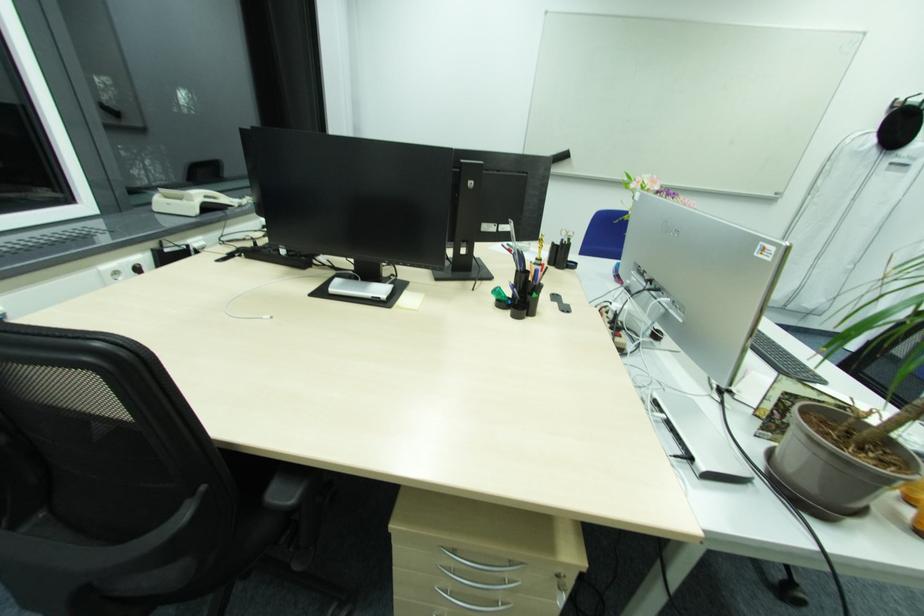
At what (x,y) coordinates should I click in order to perform the action: click on cabinet lock. Please return your answer as a coordinate pair (x, y). The height and width of the screenshot is (616, 924). Looking at the image, I should click on (563, 589).